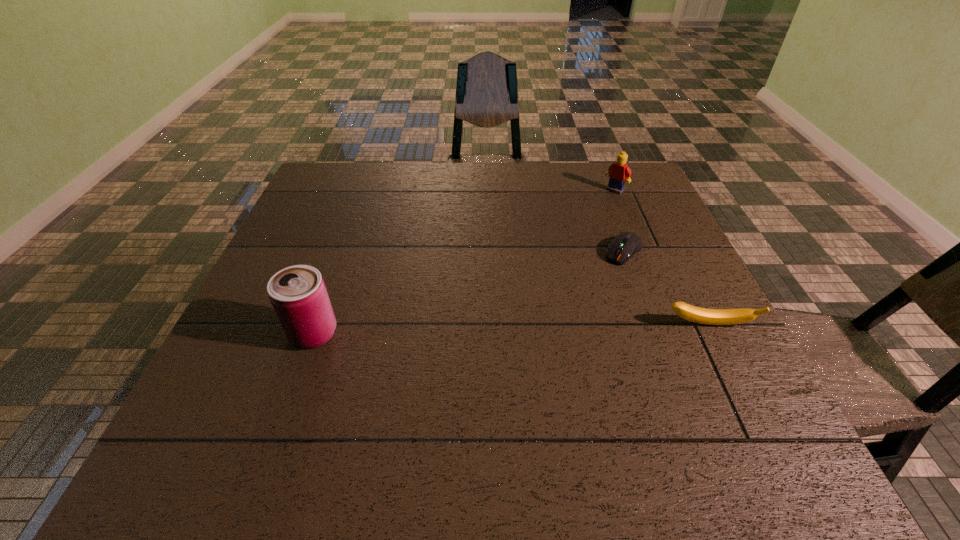
Locate an element on the screen. This screenshot has height=540, width=960. free space between the second tallest object and the banana is located at coordinates (661, 258).

What are the coordinates of `vacant space in between the shortest object and the third tallest object` in the screenshot? It's located at (666, 288).

What are the coordinates of `empty space between the leftmost object and the farthest object` in the screenshot? It's located at [x=465, y=262].

Identify the location of free space that is in between the banana and the second tallest object. This screenshot has width=960, height=540. (661, 258).

This screenshot has height=540, width=960. I want to click on blank region between the leftmost object and the third nearest object, so click(468, 292).

Identify the location of vacant area that lies between the can and the computer equipment. The image size is (960, 540). (468, 292).

This screenshot has height=540, width=960. I want to click on empty location between the Lego and the third nearest object, so click(619, 221).

Where is `empty location between the leftmost object and the Lego`? The width and height of the screenshot is (960, 540). empty location between the leftmost object and the Lego is located at coordinates (465, 262).

This screenshot has height=540, width=960. I want to click on object that is the third closest to the second shortest object, so click(x=298, y=294).

Select which object appears as the closest to the leftmost object. Please provide its 2D coordinates. Your answer should be formatted as a tuple, i.e. [(x, y)], where the tuple contains the x and y coordinates of a point satisfying the conditions above.

[(625, 245)]